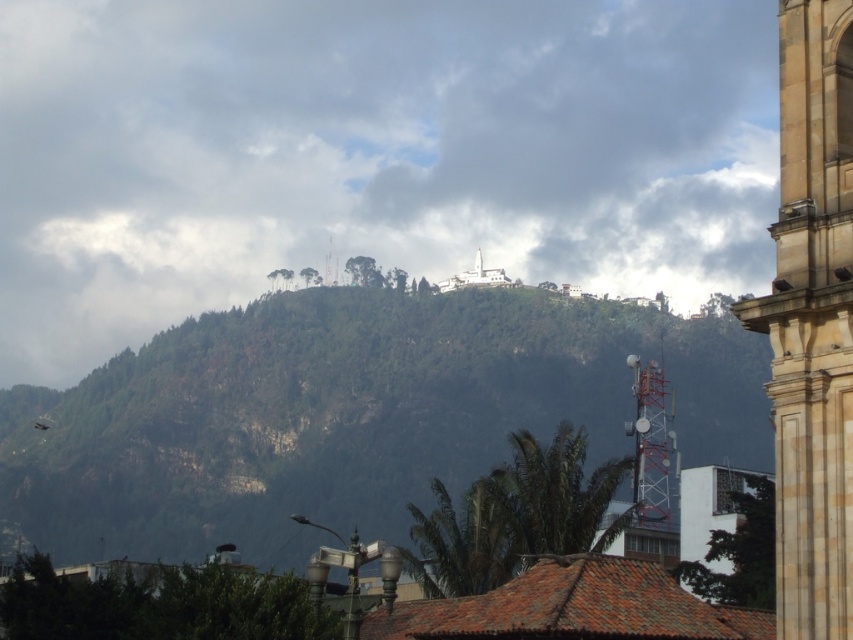
Does green forested hill at center have a smaller size compared to white marble church at upper center?

Actually, green forested hill at center might be larger than white marble church at upper center.

What do you see at coordinates (347, 416) in the screenshot?
I see `green forested hill at center` at bounding box center [347, 416].

Locate an element on the screen. The height and width of the screenshot is (640, 853). green forested hill at center is located at coordinates (347, 416).

Does green forested hill at center have a larger size compared to brown stone tower at right?

Correct, green forested hill at center is larger in size than brown stone tower at right.

Looking at this image, who is positioned more to the right, green forested hill at center or brown stone tower at right?

From the viewer's perspective, brown stone tower at right appears more on the right side.

The width and height of the screenshot is (853, 640). Find the location of `green forested hill at center`. green forested hill at center is located at coordinates (347, 416).

Between point (843, 467) and point (479, 252), which one is positioned behind?

Point (479, 252)

Is point (784, 253) farther from viewer compared to point (476, 273)?

No, (784, 253) is closer to viewer.

Is point (793, 88) behind point (466, 282)?

No, (793, 88) is closer to viewer.

Image resolution: width=853 pixels, height=640 pixels. Identify the location of brown stone tower at right. (811, 323).